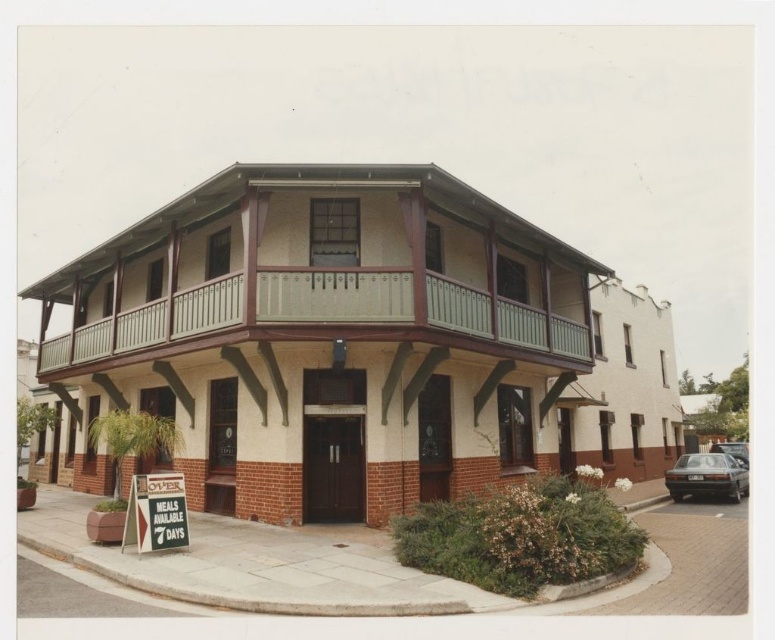
Who is lower down, dark gray metallic sedan at lower right or metallic silver car at lower right?

Positioned lower is metallic silver car at lower right.

Which of these two, dark gray metallic sedan at lower right or metallic silver car at lower right, stands taller?

metallic silver car at lower right is taller.

Which is in front, point (686, 467) or point (718, 444)?

Point (686, 467) is more forward.

Image resolution: width=775 pixels, height=640 pixels. I want to click on dark gray metallic sedan at lower right, so click(708, 476).

Who is more forward, (88, 364) or (736, 488)?

Point (88, 364)

At what (x,y) coordinates should I click in order to perform the action: click on green painted wood at upper center. Please return your answer as a coordinate pair (x, y). Looking at the image, I should click on (319, 316).

Can you confirm if green painted wood at upper center is taller than metallic silver car at lower right?

Incorrect, green painted wood at upper center's height is not larger of metallic silver car at lower right's.

Locate an element on the screen. This screenshot has width=775, height=640. green painted wood at upper center is located at coordinates (319, 316).